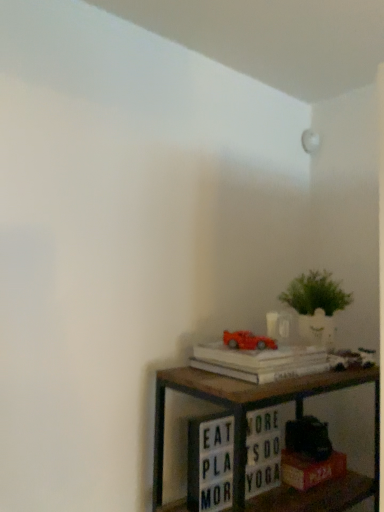
The image size is (384, 512). Describe the element at coordinates (310, 469) in the screenshot. I see `hardcover book at lower right, placed as the 1th paperback book when sorted from bottom to top` at that location.

I want to click on wooden shelf at lower right, so click(x=246, y=430).

The height and width of the screenshot is (512, 384). What do you see at coordinates (247, 341) in the screenshot? I see `shiny plastic car at upper right` at bounding box center [247, 341].

Measure the distance between point (321, 333) and camera.

1.24 meters.

This screenshot has width=384, height=512. What are the coordinates of `white paper at upper right, arranged as the first paperback book when viewed from the top` in the screenshot? It's located at (256, 357).

You are a GUI agent. You are given a task and a screenshot of the screen. Output one action in this format:
    pyautogui.click(x=<x>, y=<y>)
    Task: Click on the hardcover book at lower right, placed as the 1th paperback book when sorted from bottom to top
    The height and width of the screenshot is (512, 384).
    Given the screenshot: What is the action you would take?
    pyautogui.click(x=310, y=469)

Considering the relative positions of shiny plastic car at upper right and wooden shelf at lower right in the image provided, is shiny plastic car at upper right behind wooden shelf at lower right?

Yes, the depth of shiny plastic car at upper right is greater than that of wooden shelf at lower right.

From a real-world perspective, which is physically below, shiny plastic car at upper right or wooden shelf at lower right?

wooden shelf at lower right.

Where is `shelf lying below the shiny plastic car at upper right (from the image's perspective)`? This screenshot has width=384, height=512. shelf lying below the shiny plastic car at upper right (from the image's perspective) is located at coordinates tap(246, 430).

Which is more distant, (301, 336) or (224, 386)?

The point (301, 336) is behind.

Is green leafy plant in white pot at lower right inside the boundaries of wooden shelf at lower right, or outside?

green leafy plant in white pot at lower right is spatially situated outside wooden shelf at lower right.

Is green leafy plant in white pot at lower right shorter than wooden shelf at lower right?

Correct, green leafy plant in white pot at lower right is not as tall as wooden shelf at lower right.

From the image's perspective, is green leafy plant in white pot at lower right above wooden shelf at lower right?

Yes, from the image's perspective, green leafy plant in white pot at lower right is on top of wooden shelf at lower right.

Is wooden shelf at lower right wider than shiny plastic car at upper right?

Correct, the width of wooden shelf at lower right exceeds that of shiny plastic car at upper right.

Locate an element on the screen. toy above the wooden shelf at lower right (from a real-world perspective) is located at coordinates (247, 341).

Considering the relative sizes of wooden shelf at lower right and shiny plastic car at upper right in the image provided, is wooden shelf at lower right smaller than shiny plastic car at upper right?

Result: No.

From a real-world perspective, between wooden shelf at lower right and shiny plastic car at upper right, who is vertically higher?

shiny plastic car at upper right is physically above.

How many degrees apart are the facing directions of shiny plastic car at upper right and green leafy plant in white pot at lower right?

There is a 0.71-degree angle between the facing directions of shiny plastic car at upper right and green leafy plant in white pot at lower right.

Is shiny plastic car at upper right positioned far away from green leafy plant in white pot at lower right?

shiny plastic car at upper right is near green leafy plant in white pot at lower right, not far away.

Which of these two, shiny plastic car at upper right or green leafy plant in white pot at lower right, stands taller?

green leafy plant in white pot at lower right.

Would you say green leafy plant in white pot at lower right is part of shiny plastic car at upper right's contents?

Definitely not — green leafy plant in white pot at lower right is not inside shiny plastic car at upper right.

From the image's perspective, relative to shiny plastic car at upper right, is hardcover book at lower right, the second paperback book positioned from the top, above or below?

hardcover book at lower right, the second paperback book positioned from the top, is situated lower than shiny plastic car at upper right in the image.

Considering the sizes of hardcover book at lower right, the second paperback book positioned from the top, and shiny plastic car at upper right in the image, is hardcover book at lower right, the second paperback book positioned from the top, bigger or smaller than shiny plastic car at upper right?

In the image, hardcover book at lower right, the second paperback book positioned from the top, appears to be larger than shiny plastic car at upper right.

Would you say hardcover book at lower right, the second paperback book positioned from the top, is to the left or to the right of shiny plastic car at upper right in the picture?

Based on their positions, hardcover book at lower right, the second paperback book positioned from the top, is located to the right of shiny plastic car at upper right.

Is hardcover book at lower right, the second paperback book positioned from the top, beside shiny plastic car at upper right?

No, hardcover book at lower right, the second paperback book positioned from the top, is not touching shiny plastic car at upper right.

Between green leafy plant in white pot at lower right and hardcover book at lower right, the second paperback book positioned from the top, which one has less height?

hardcover book at lower right, the second paperback book positioned from the top.

Between green leafy plant in white pot at lower right and hardcover book at lower right, the second paperback book positioned from the top, which one has larger size?

With larger size is green leafy plant in white pot at lower right.

From the image's perspective, is green leafy plant in white pot at lower right above or below hardcover book at lower right, the second paperback book positioned from the top?

From the image's perspective, green leafy plant in white pot at lower right appears above hardcover book at lower right, the second paperback book positioned from the top.

From a real-world perspective, relative to white paper at upper right, arranged as the first paperback book when viewed from the top, is shiny plastic car at upper right vertically above or below?

In terms of real-world spatial position, shiny plastic car at upper right is above white paper at upper right, arranged as the first paperback book when viewed from the top.

Consider the image. How many degrees apart are the facing directions of shiny plastic car at upper right and white paper at upper right, arranged as the first paperback book when viewed from the top?

They differ by 0.00256 degrees in their facing directions.

Based on the photo, could you measure the distance between shiny plastic car at upper right and white paper at upper right, positioned as the 2th paperback book in bottom-to-top order?

shiny plastic car at upper right is 2.13 inches from white paper at upper right, positioned as the 2th paperback book in bottom-to-top order.

Does shiny plastic car at upper right have a greater height compared to white paper at upper right, arranged as the first paperback book when viewed from the top?

No.

You are a GUI agent. You are given a task and a screenshot of the screen. Output one action in this format:
    pyautogui.click(x=<x>, y=<y>)
    Task: Click on the shelf below the shiny plastic car at upper right (from the image's perspective)
    The width and height of the screenshot is (384, 512).
    Given the screenshot: What is the action you would take?
    pyautogui.click(x=246, y=430)

Where is `shelf that appears in front of the green leafy plant in white pot at lower right`? The width and height of the screenshot is (384, 512). shelf that appears in front of the green leafy plant in white pot at lower right is located at coordinates (246, 430).

Based on the photo, based on their spatial positions, is green leafy plant in white pot at lower right or wooden shelf at lower right further from shiny plastic car at upper right?

Based on the image, green leafy plant in white pot at lower right appears to be further to shiny plastic car at upper right.

From the picture: Considering their positions, is green leafy plant in white pot at lower right positioned further to wooden shelf at lower right than shiny plastic car at upper right?

green leafy plant in white pot at lower right.

From the image, which object appears to be farther from hardcover book at lower right, the second paperback book positioned from the top, white paper at upper right, positioned as the 2th paperback book in bottom-to-top order, or wooden shelf at lower right?

Among the two, white paper at upper right, positioned as the 2th paperback book in bottom-to-top order, is located further to hardcover book at lower right, the second paperback book positioned from the top.

Which object lies further to the anchor point hardcover book at lower right, the second paperback book positioned from the top, wooden shelf at lower right or white paper at upper right, positioned as the 2th paperback book in bottom-to-top order?

white paper at upper right, positioned as the 2th paperback book in bottom-to-top order, is positioned further to the anchor hardcover book at lower right, the second paperback book positioned from the top.

When comparing their distances from green leafy plant in white pot at lower right, does white paper at upper right, positioned as the 2th paperback book in bottom-to-top order, or shiny plastic car at upper right seem closer?

white paper at upper right, positioned as the 2th paperback book in bottom-to-top order, lies closer to green leafy plant in white pot at lower right than the other object.

Looking at the image, which one is located further to wooden shelf at lower right, hardcover book at lower right, placed as the 1th paperback book when sorted from bottom to top, or shiny plastic car at upper right?

shiny plastic car at upper right is further to wooden shelf at lower right.

Estimate the real-world distances between objects in this image. Which object is closer to hardcover book at lower right, the second paperback book positioned from the top, green leafy plant in white pot at lower right or white paper at upper right, positioned as the 2th paperback book in bottom-to-top order?

The object closer to hardcover book at lower right, the second paperback book positioned from the top, is white paper at upper right, positioned as the 2th paperback book in bottom-to-top order.

Estimate the real-world distances between objects in this image. Which object is further from hardcover book at lower right, placed as the 1th paperback book when sorted from bottom to top, wooden shelf at lower right or shiny plastic car at upper right?

shiny plastic car at upper right lies further to hardcover book at lower right, placed as the 1th paperback book when sorted from bottom to top, than the other object.

The image size is (384, 512). Find the location of `paperback book that lies between shiny plastic car at upper right and hardcover book at lower right, placed as the 1th paperback book when sorted from bottom to top, from top to bottom`. paperback book that lies between shiny plastic car at upper right and hardcover book at lower right, placed as the 1th paperback book when sorted from bottom to top, from top to bottom is located at coordinates coord(256,357).

Where is `paperback book that lies between green leafy plant in white pot at lower right and wooden shelf at lower right from top to bottom`? Image resolution: width=384 pixels, height=512 pixels. paperback book that lies between green leafy plant in white pot at lower right and wooden shelf at lower right from top to bottom is located at coordinates (256, 357).

The height and width of the screenshot is (512, 384). I want to click on shelf between shiny plastic car at upper right and hardcover book at lower right, placed as the 1th paperback book when sorted from bottom to top, vertically, so click(246, 430).

Find the location of a particular element. The width and height of the screenshot is (384, 512). shelf between green leafy plant in white pot at lower right and hardcover book at lower right, the second paperback book positioned from the top, in the up-down direction is located at coordinates (246, 430).